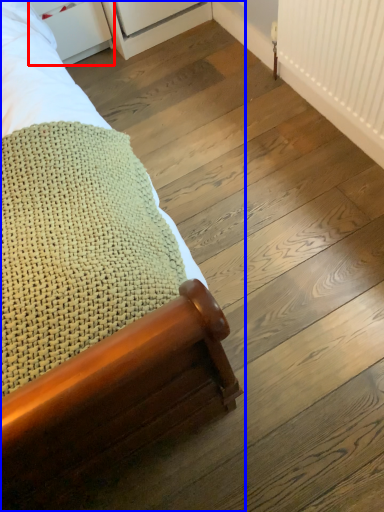
Question: Which object is further to the camera taking this photo, drawer (highlighted by a red box) or bed (highlighted by a blue box)?

Choices:
 (A) drawer
 (B) bed

Answer: (A)